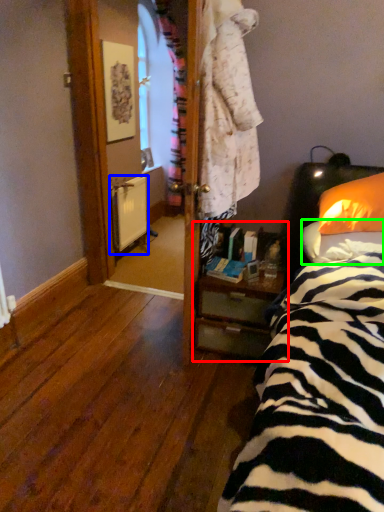
Question: Based on their relative distances, which object is farther from nightstand (highlighted by a red box)? Choose from radiator (highlighted by a blue box) and pillow (highlighted by a green box).

Choices:
 (A) radiator
 (B) pillow

Answer: (A)